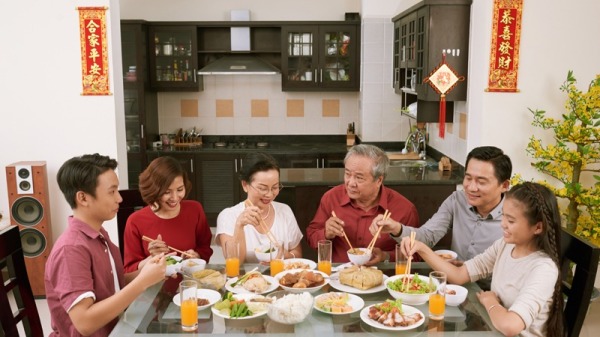
Find the location of a particular element. This screenshot has height=337, width=600. drinking glass is located at coordinates 438,299, 403,259, 326,254, 278,249, 232,242, 187,287.